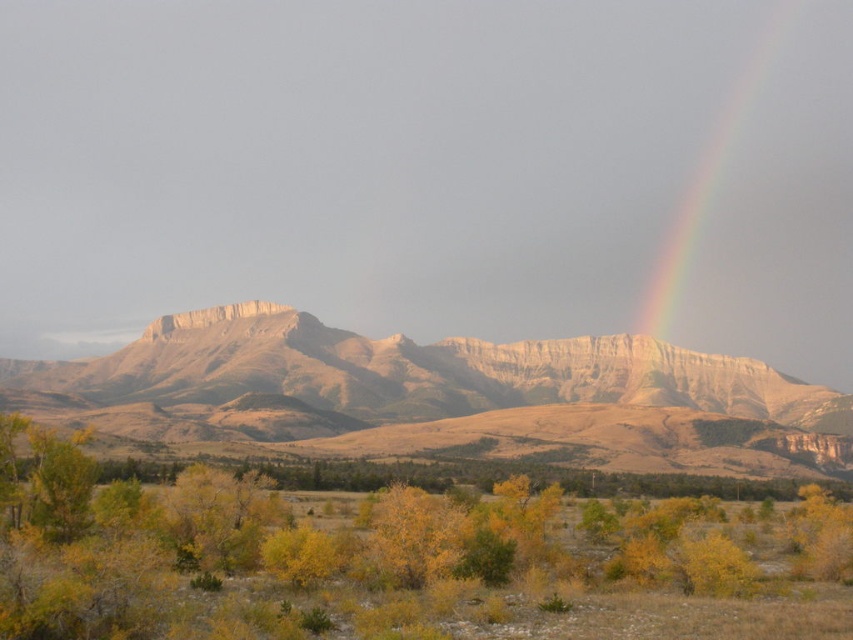
Which is in front, point (328, 371) or point (729, 104)?

Point (328, 371) is more forward.

Is rugged sandstone mountain range at center bigger than rainbow at upper right?

Yes.

Which is in front, point (28, 392) or point (724, 163)?

Point (28, 392) is in front.

The width and height of the screenshot is (853, 640). I want to click on rugged sandstone mountain range at center, so click(x=405, y=376).

Is yellow leafy shrub at lower center to the right of rainbow at upper right from the viewer's perspective?

No, yellow leafy shrub at lower center is not to the right of rainbow at upper right.

Where is `yellow leafy shrub at lower center`? The height and width of the screenshot is (640, 853). yellow leafy shrub at lower center is located at coordinates (393, 560).

Does point (395, 604) lie in front of point (450, 378)?

Yes, it is.

Is yellow leafy shrub at lower center shorter than rugged sandstone mountain range at center?

Yes.

Which is behind, point (263, 637) or point (241, 360)?

Positioned behind is point (241, 360).

Image resolution: width=853 pixels, height=640 pixels. Find the location of `yellow leafy shrub at lower center`. yellow leafy shrub at lower center is located at coordinates (393, 560).